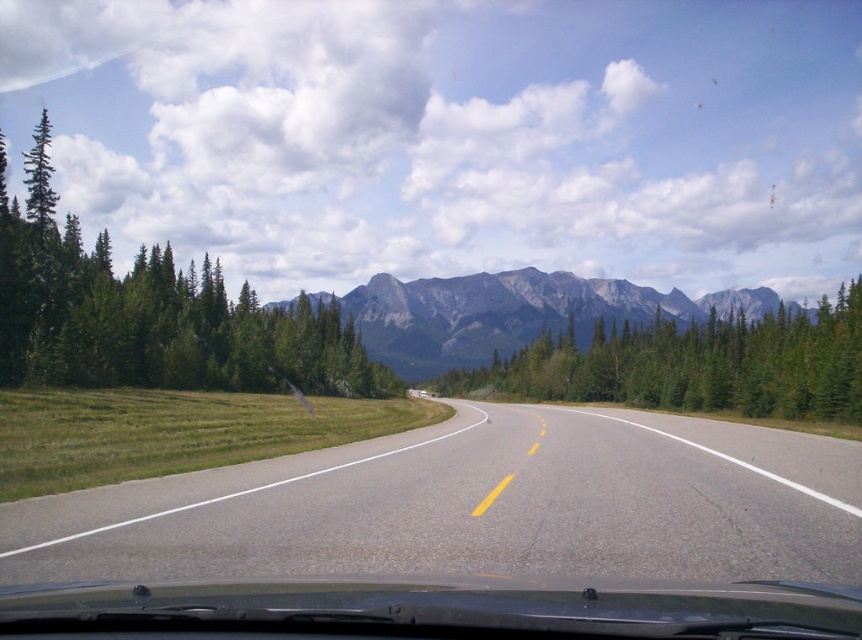
You are driving a car and want to know how far the point at coordinates (667, 538) is from your current position. Can you determine the distance?

The point at coordinates (667, 538) is 8.29 meters away from your current position.

You are driving a car and see the green textured pine trees at center and the gray rocky mountain at center through the windshield. Which object appears closer to you based on their sizes?

The green textured pine trees at center appears closer because it has a smaller size compared to the gray rocky mountain at center, which is farther away.

You are driving a car and notice the green matte tree at left and the gray rocky mountain at center through the windshield. Which object appears closer to the vehicle based on their sizes?

The green matte tree at left appears closer to the vehicle because it is taller in the image than the gray rocky mountain at center, which is farther away.